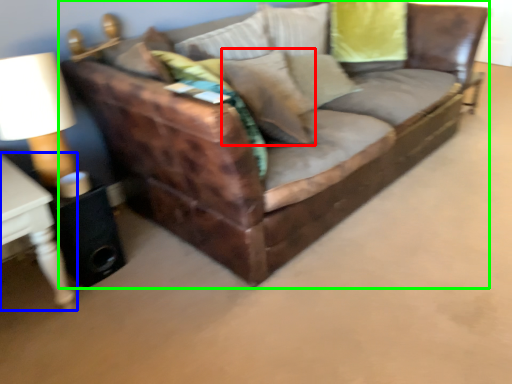
Question: Which object is the farthest from pillow (highlighted by a red box)? Choose among these: table (highlighted by a blue box) or studio couch (highlighted by a green box).

Choices:
 (A) table
 (B) studio couch

Answer: (A)